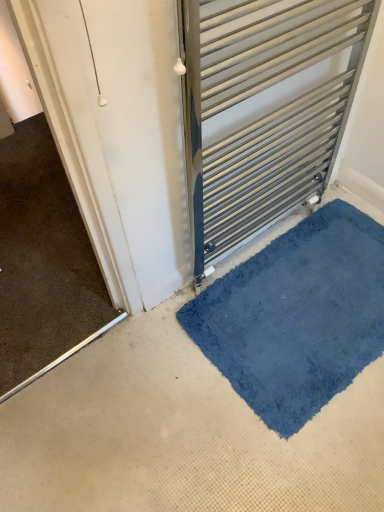
Question: Would you say satin silver towel rack at center is to the left or to the right of blue plush bath mat at lower right in the picture?

Choices:
 (A) right
 (B) left

Answer: (B)

Question: In terms of height, does satin silver towel rack at center look taller or shorter compared to blue plush bath mat at lower right?

Choices:
 (A) short
 (B) tall

Answer: (B)

Question: From a real-world perspective, relative to blue plush bath mat at lower right, is satin silver towel rack at center vertically above or below?

Choices:
 (A) below
 (B) above

Answer: (B)

Question: Do you think blue plush bath mat at lower right is within satin silver towel rack at center, or outside of it?

Choices:
 (A) inside
 (B) outside

Answer: (B)

Question: Considering the relative positions of blue plush bath mat at lower right and satin silver towel rack at center in the image provided, is blue plush bath mat at lower right to the left or to the right of satin silver towel rack at center?

Choices:
 (A) right
 (B) left

Answer: (A)

Question: Is point (203, 350) closer or farther from the camera than point (251, 124)?

Choices:
 (A) closer
 (B) farther

Answer: (B)

Question: Based on their sizes in the image, would you say blue plush bath mat at lower right is bigger or smaller than satin silver towel rack at center?

Choices:
 (A) big
 (B) small

Answer: (B)